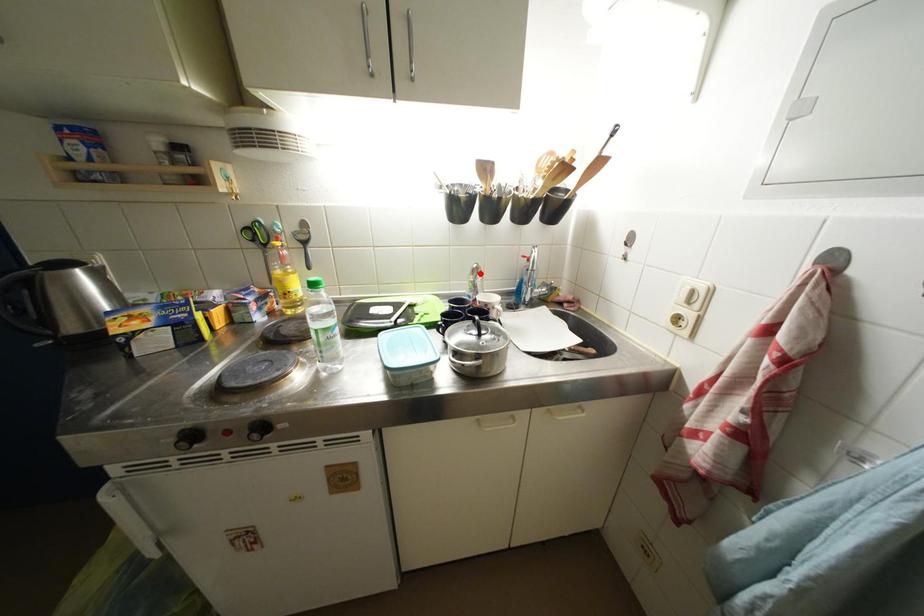
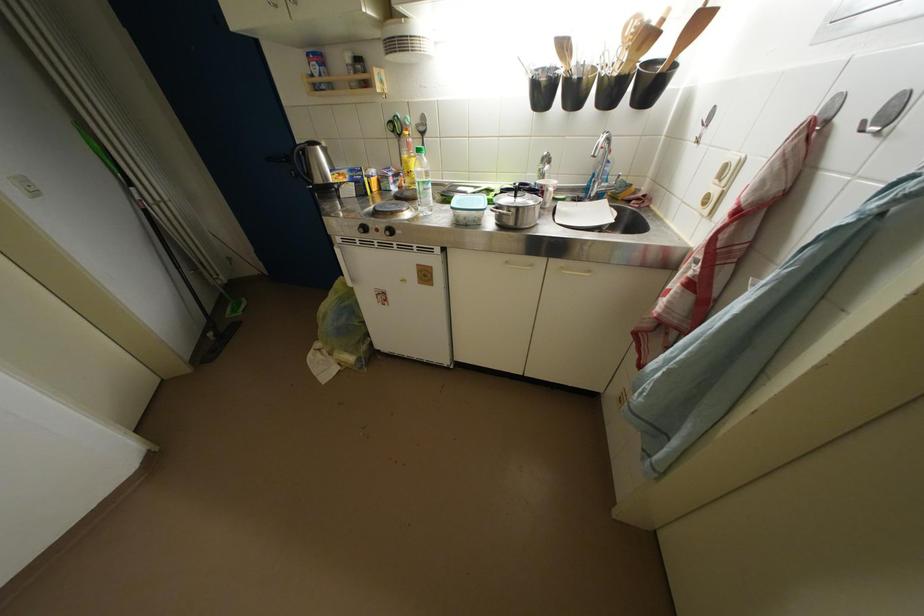
Find the pixel in the second image that matches the highlighted location in the first image.

(551, 161)